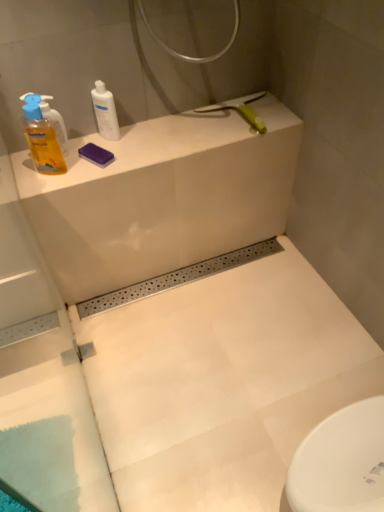
Identify the location of free space to the left of white glossy bottle at upper left, arranged as the 2th cleaning product when viewed from the left. The width and height of the screenshot is (384, 512). (64, 150).